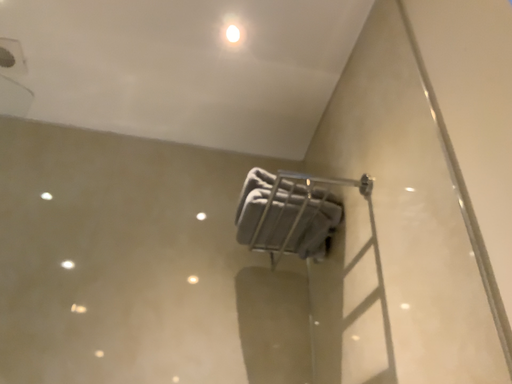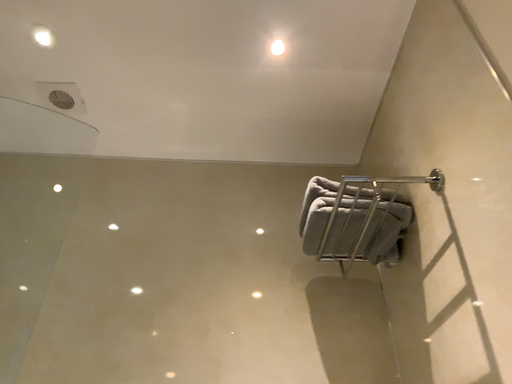
Question: How did the camera likely rotate when shooting the video?

Choices:
 (A) rotated right
 (B) rotated left

Answer: (B)